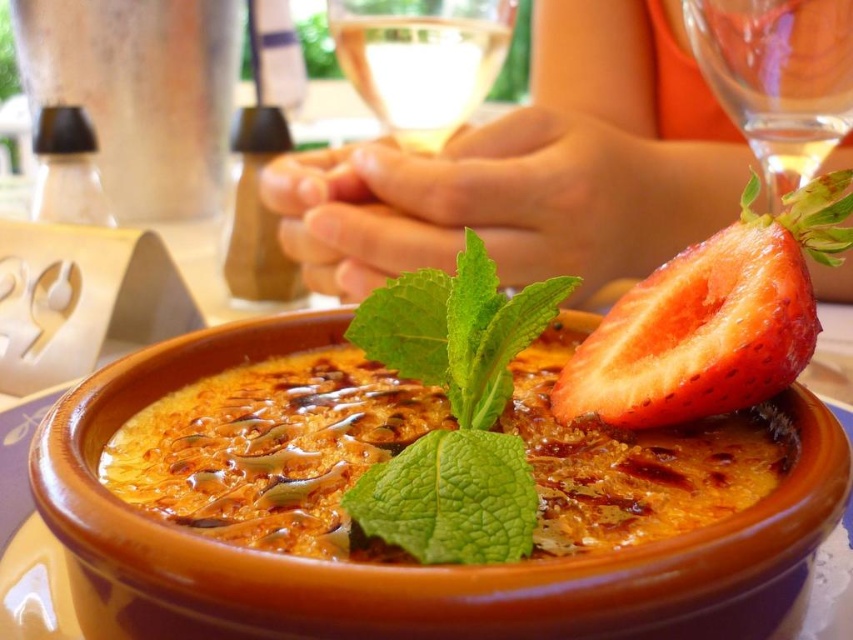
You are a chef preparing a dessert display. You have a matte clay bowl at center and a transparent glass at upper right. Which container can hold more volume of liquid?

The matte clay bowl at center can hold more volume of liquid because it is bigger than the transparent glass at upper right.

You are a food stylist arranging a dessert photo shoot. You have two points marked on the image where you need to place garnishes. The first point is at coordinate point(490, 406) and the second is at point(328, 12). According to the scene description, which garnish should be placed at the point that is closer to the viewer?

The point at point(490, 406) is closer to the viewer than point(328, 12). Therefore, the garnish should be placed at point(490, 406) since it is in front.

You are a food photographer and need to position a spoon to take a closeup shot of the crme brl in the rustic terracotta bowl. The transparent glass at upper right is in the way. Can you move the glass to the left to make space?

The transparent glass at upper right is located at point (778,77), so moving it to the left would require adjusting its position along the x and y coordinates to ensure it no longer obstructs the spoon placement for the closeup shot.